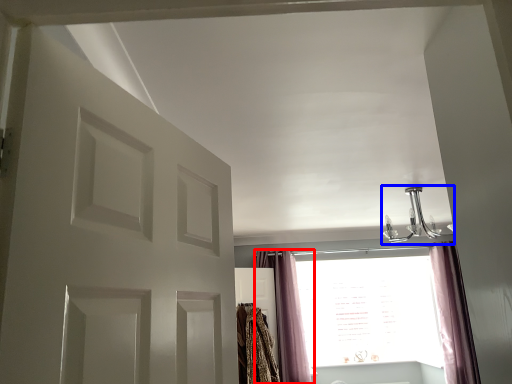
Question: Which object appears farthest to the camera in this image, curtain (highlighted by a red box) or light fixture (highlighted by a blue box)?

Choices:
 (A) curtain
 (B) light fixture

Answer: (A)